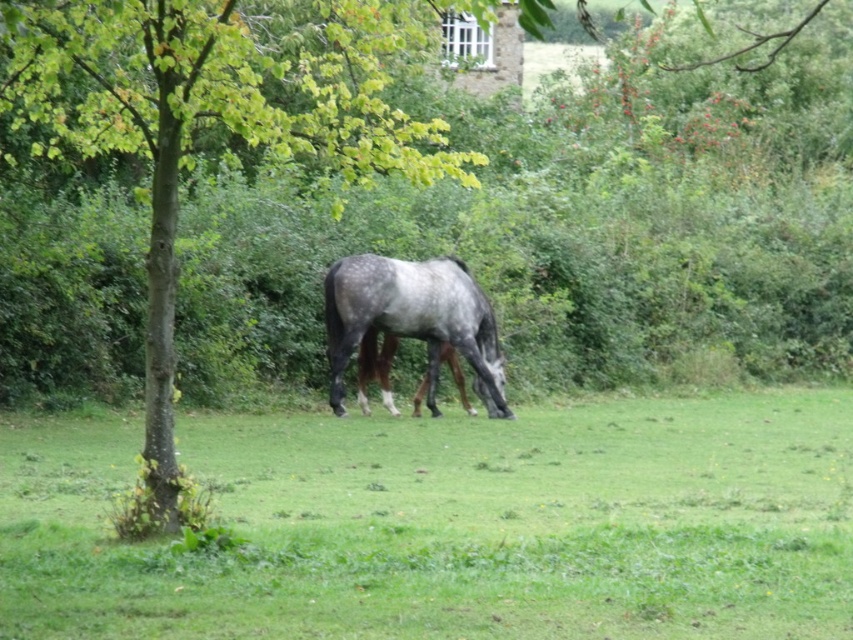
You are a photographer standing at the edge of the field. You want to capture a closeup shot of the green grass at center without moving closer than 6 meters. Can you achieve this with your current position?

The distance between the green grass at center and the camera is 6.56 meters. Since you need to stay at least 6 meters away, you can still take the closeup shot from your current position as you are within the required distance range.

You are standing in the field and see the green leafy tree at center and the speckled gray horse at center. Which object is closer to your left side?

The green leafy tree at center is to the left of the speckled gray horse at center, so it is closer to your left side.

You are a farmer checking the field where your horse is grazing. You notice the green grass at center and the green leafy tree at center. Which one is closer to the horse?

The green grass at center is closer to the horse since it has a smaller size compared to the green leafy tree at center, indicating it is nearer.